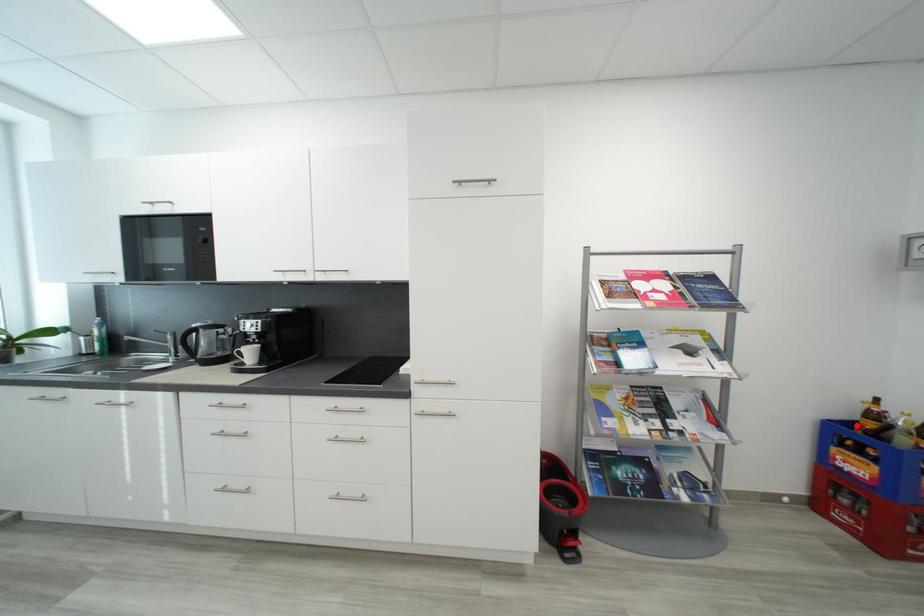
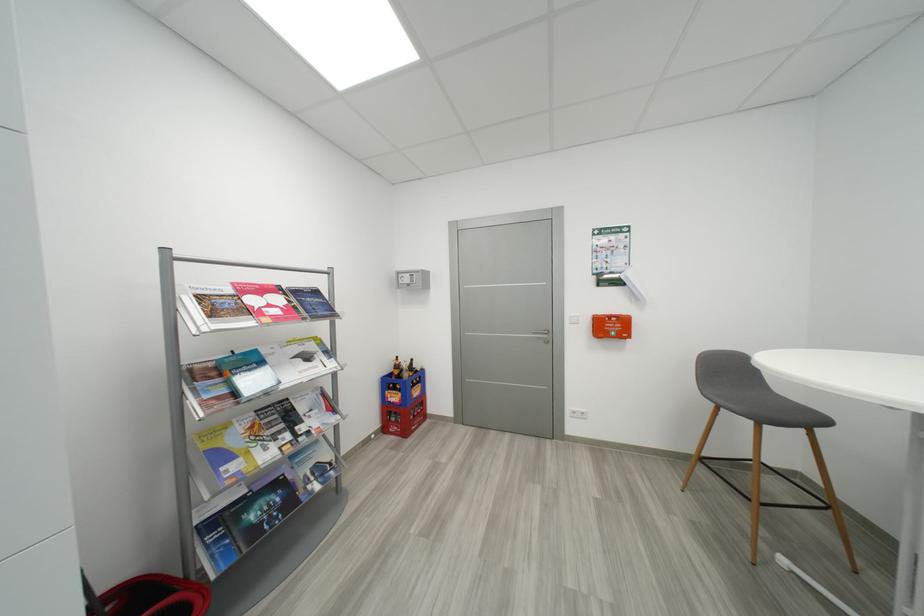
Where in the second image is the point corresponding to the highlighted location from the first image?

(397, 377)